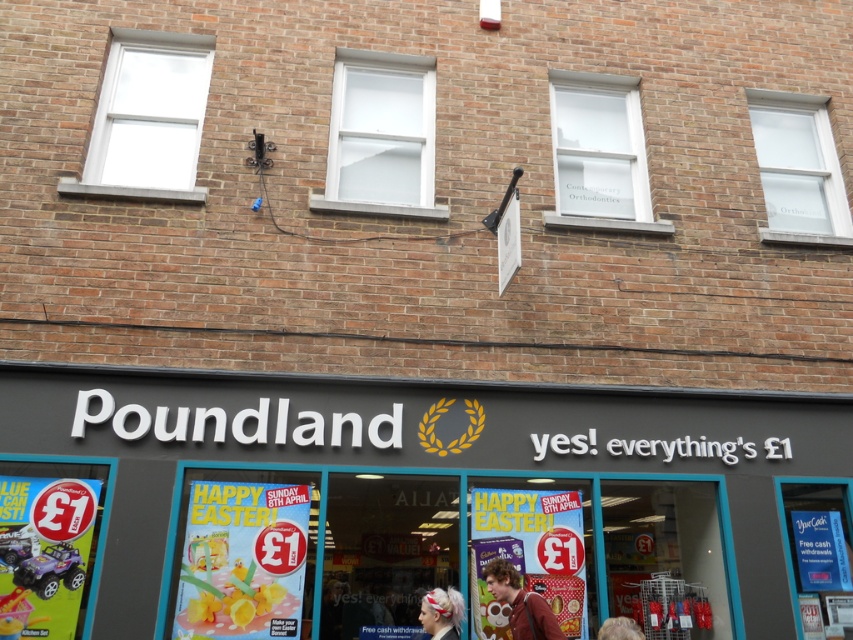
You are standing at the entrance of the Poundland store. You want to take a photo of the point located at coordinate point (788, 241). The camera you have can focus on objects within 6 meters. Will you be able to take a clear photo of the point?

The point (788, 241) and camera are 6.19 meters apart from each other. Since the camera can focus on objects within 6 meters, the distance is slightly beyond its range. Therefore, you won not be able to take a clear photo of the point.

You are standing in front of the Poundland store and want to locate the white glass window at center. Which coordinates should you look at?

You should look at point coordinates at (381, 134) to find the white glass window at center.

You are a customer standing outside the Poundland store looking at the entrance. You see a person with blonde hair at lower center and a white glass window at center. Which object is closer to you?

The white glass window at center is closer to you because the blonde hair at lower center is behind it.